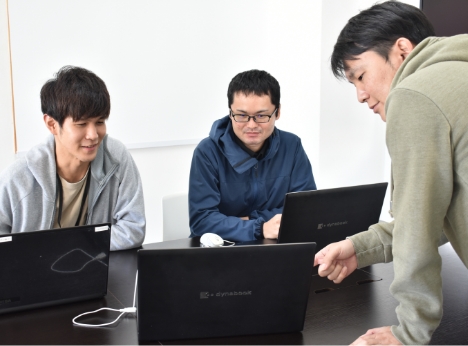
I want to click on wall, so click(x=156, y=70).